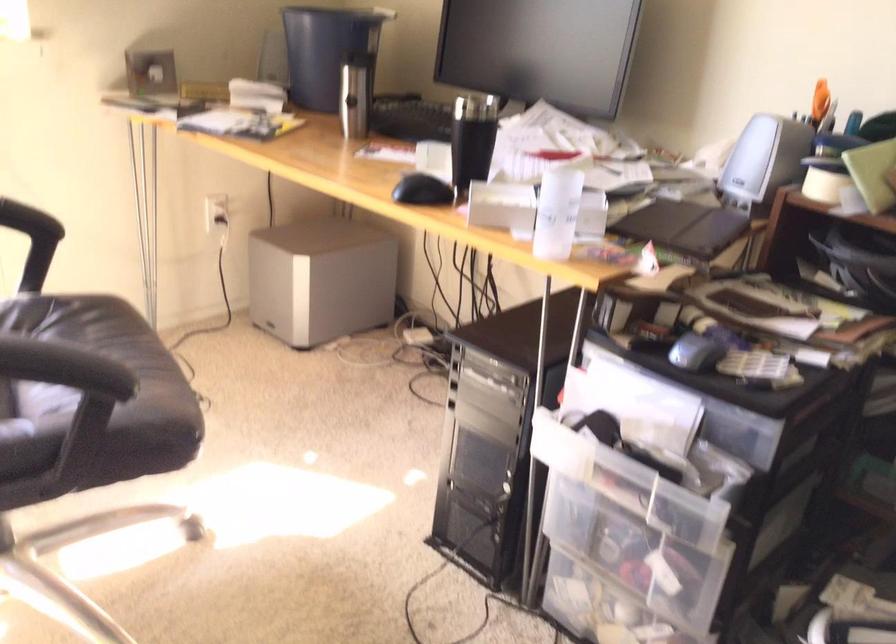
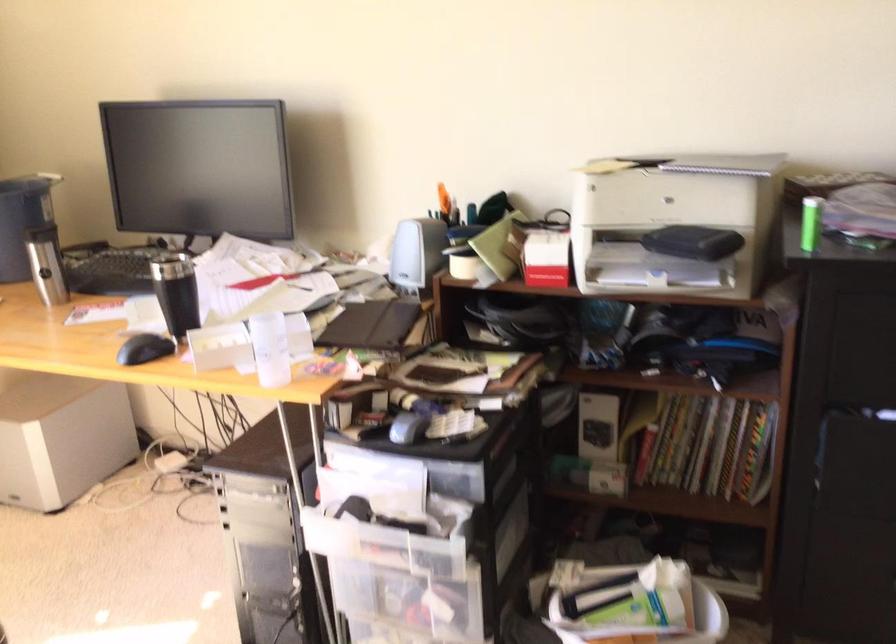
In the second image, find the point that corresponds to (x=681, y=225) in the first image.

(372, 325)